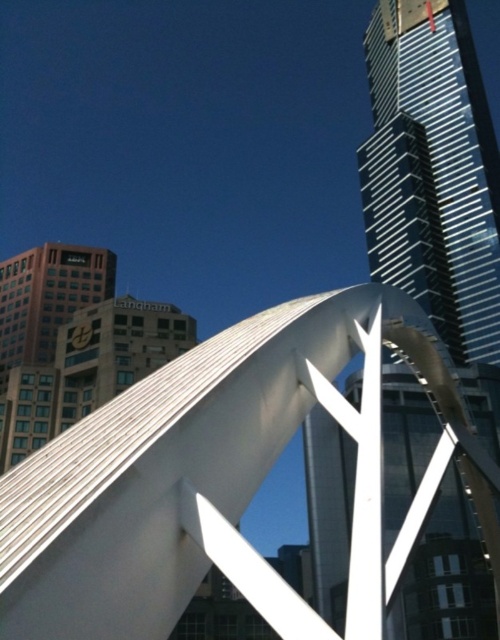
You are an architect evaluating the spatial compatibility of the white polished metal sculpture at center and the polished glass skyscraper at center in the urban landscape. Based on their widths, which object would require more horizontal space for installation?

The polished glass skyscraper at center requires more horizontal space for installation since it has a greater width than the white polished metal sculpture at center according to the description.

You are standing in the urban landscape and want to take a photo of both the white polished metal sculpture at center and the polished glass skyscraper at center. Which object should you focus on first to ensure both are in frame?

You should focus on the white polished metal sculpture at center first since it is closer to you than the polished glass skyscraper at center, allowing both to be captured in the frame.